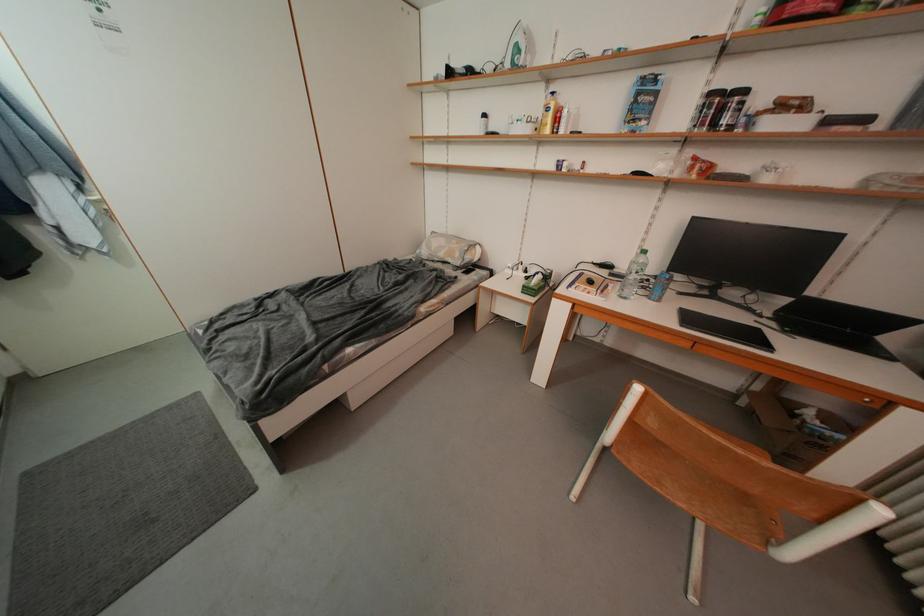
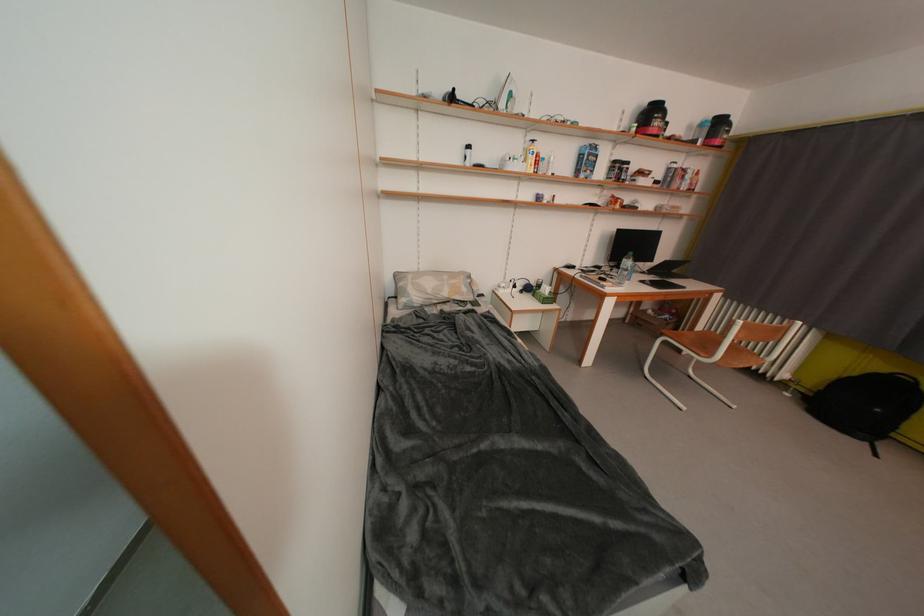
Find the pixel in the second image that matches point 465,257 in the first image.

(471, 293)